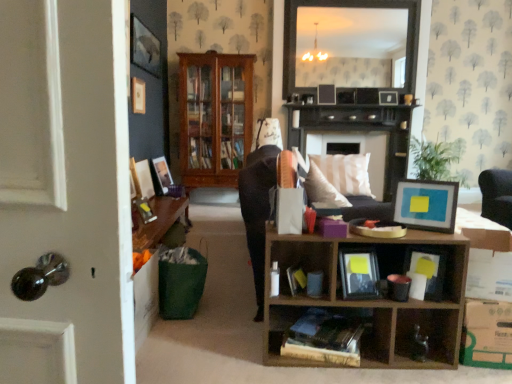
Question: Could matte black picture frame at upper center, which ranks as the 1th picture frame in right-to-left order, be considered to be inside matte black mirror at upper center?

Choices:
 (A) no
 (B) yes

Answer: (B)

Question: Is matte black mirror at upper center closer to camera compared to matte black picture frame at upper center, which ranks as the 1th picture frame in right-to-left order?

Choices:
 (A) no
 (B) yes

Answer: (B)

Question: Does matte black mirror at upper center have a lesser height compared to matte black picture frame at upper center, which appears as the 7th picture frame when viewed from the left?

Choices:
 (A) yes
 (B) no

Answer: (B)

Question: From the image's perspective, is matte black mirror at upper center under matte black picture frame at upper center, which appears as the 7th picture frame when viewed from the left?

Choices:
 (A) yes
 (B) no

Answer: (B)

Question: Does matte black mirror at upper center appear on the left side of matte black picture frame at upper center, which ranks as the 1th picture frame in right-to-left order?

Choices:
 (A) yes
 (B) no

Answer: (A)

Question: From the image's perspective, is hardcover book at center, placed as the third book when sorted from right to left, above or below white cardboard box at lower right?

Choices:
 (A) above
 (B) below

Answer: (B)

Question: Based on their sizes in the image, would you say hardcover book at center, placed as the third book when sorted from right to left, is bigger or smaller than white cardboard box at lower right?

Choices:
 (A) big
 (B) small

Answer: (B)

Question: From their relative heights in the image, would you say hardcover book at center, placed as the third book when sorted from right to left, is taller or shorter than white cardboard box at lower right?

Choices:
 (A) short
 (B) tall

Answer: (A)

Question: From a real-world perspective, is hardcover book at center, placed as the third book when sorted from right to left, positioned above or below white cardboard box at lower right?

Choices:
 (A) above
 (B) below

Answer: (B)

Question: Relative to blue matte picture frame at center, which appears as the fourth picture frame when viewed from the left, is matte black photo frame at center, acting as the second book starting from the right, in front or behind?

Choices:
 (A) behind
 (B) front

Answer: (B)

Question: From a real-world perspective, relative to blue matte picture frame at center, the first picture frame viewed from the front, is matte black photo frame at center, the second book positioned from the left, vertically above or below?

Choices:
 (A) below
 (B) above

Answer: (A)

Question: From the image's perspective, is matte black photo frame at center, the second book positioned from the left, positioned above or below blue matte picture frame at center, which appears as the fourth picture frame when viewed from the left?

Choices:
 (A) above
 (B) below

Answer: (B)

Question: Is matte black photo frame at center, acting as the second book starting from the right, situated inside blue matte picture frame at center, which appears as the fourth picture frame when viewed from the left, or outside?

Choices:
 (A) inside
 (B) outside

Answer: (B)

Question: From the image's perspective, is matte wooden picture frame at left, the 3th picture frame when ordered from left to right, located above or below dark wood fireplace at center?

Choices:
 (A) above
 (B) below

Answer: (B)

Question: Looking at the image, does matte wooden picture frame at left, the 3th picture frame when ordered from left to right, seem bigger or smaller compared to dark wood fireplace at center?

Choices:
 (A) big
 (B) small

Answer: (B)